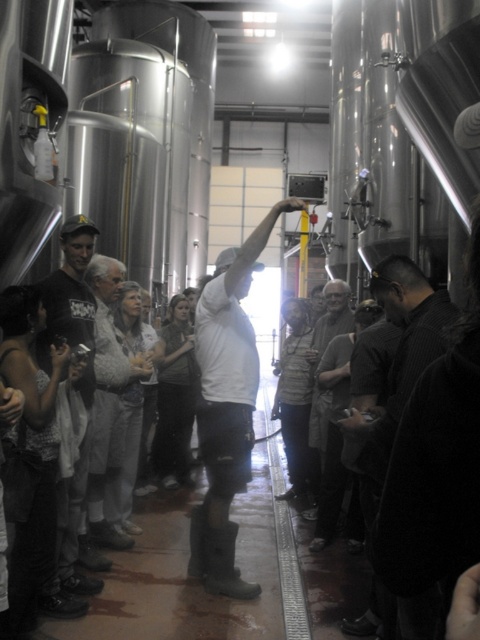
You are standing in the brewery and want to hand a document to the person wearing the dark gray shirt at center and the gray knit sweater at center. Which one is closer to you so you can hand the document first?

The dark gray shirt at center is closer to the viewer than the gray knit sweater at center, so you should hand the document to the dark gray shirt at center first.

You are a photographer trying to capture the man in the white matte shirt at center and light gray fabric jacket at center. Since you want to focus on the man, which clothing item should you adjust your camera to focus on first?

The white matte shirt at center is located above the light gray fabric jacket at center, so you should focus on the white matte shirt at center first as it is closer to the camera.

Where is the white matte shirt at center located in the image?

The white matte shirt at center is located at the 2D coordinates point (x=227, y=406) in the image.